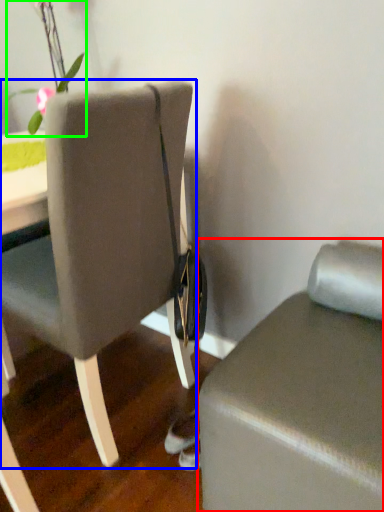
Question: Based on their relative distances, which object is nearer to furniture (highlighted by a red box)? Choose from chair (highlighted by a blue box) and floral arrangement (highlighted by a green box).

Choices:
 (A) chair
 (B) floral arrangement

Answer: (A)